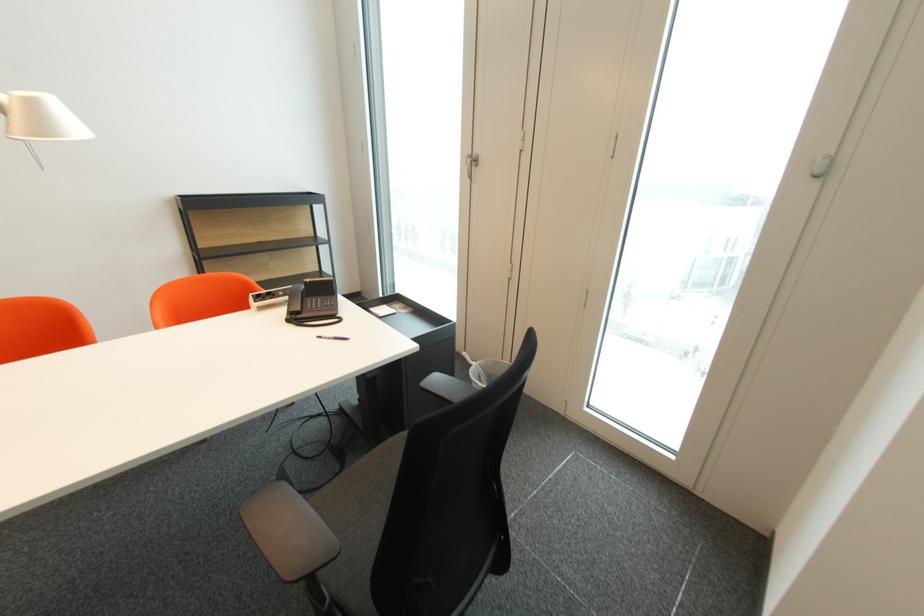
Describe the element at coordinates (367, 507) in the screenshot. This screenshot has width=924, height=616. I see `a grey chair sitting surface` at that location.